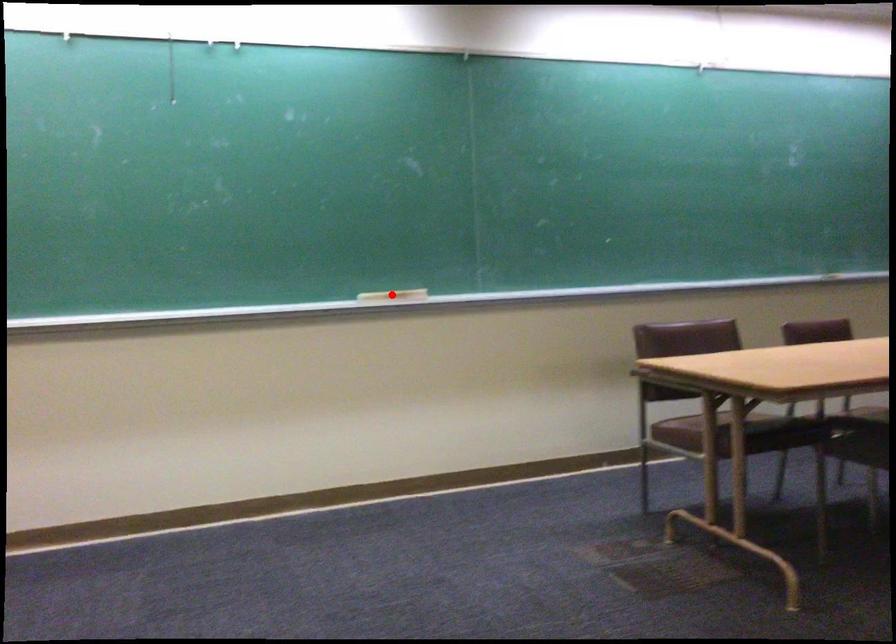
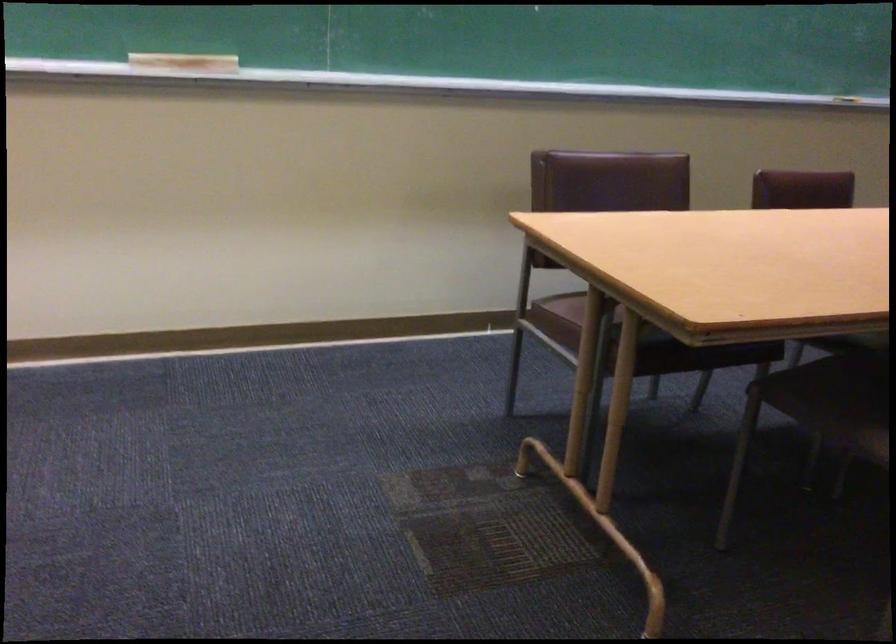
Question: A red point is marked in image1. In image2, is the corresponding 3D point closer to the camera or farther? Reply with the corresponding letter.

Choices:
 (A) The corresponding 3D point is closer.
 (B) The corresponding 3D point is farther.

Answer: (A)